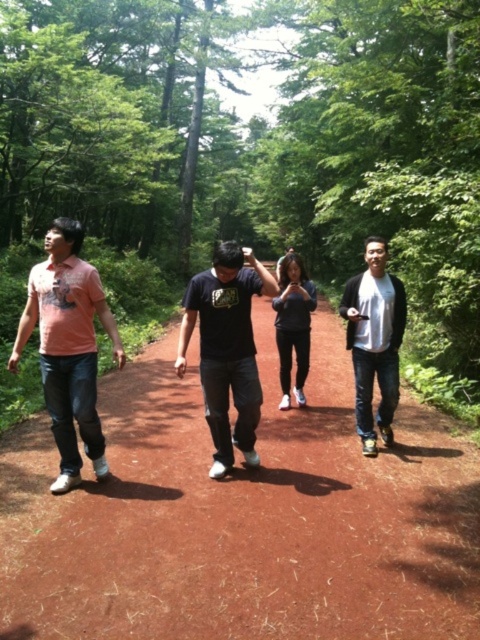
Is point (240, 294) farther from camera compared to point (301, 316)?

No, it is in front of (301, 316).

Which is below, black matte shirt at center or dark gray fabric pants at center?

black matte shirt at center

Is point (182, 337) behind point (303, 276)?

No, it is in front of (303, 276).

Where is `black matte shirt at center`? black matte shirt at center is located at coordinates (x=227, y=348).

Is matte pink shirt at left thinner than dark gray fabric pants at center?

No.

Consider the image. Is matte pink shirt at left smaller than dark gray fabric pants at center?

Actually, matte pink shirt at left might be larger than dark gray fabric pants at center.

Does point (84, 358) come in front of point (299, 336)?

Yes, it is in front of point (299, 336).

Identify the location of matte pink shirt at left. (68, 346).

Is matte pink shirt at left below black matte jacket at right?

Yes, matte pink shirt at left is below black matte jacket at right.

Which is above, matte pink shirt at left or black matte jacket at right?

black matte jacket at right is above.

Is point (72, 412) positioned behind point (399, 301)?

No, it is in front of (399, 301).

Find the location of a particular element. The height and width of the screenshot is (640, 480). matte pink shirt at left is located at coordinates (68, 346).